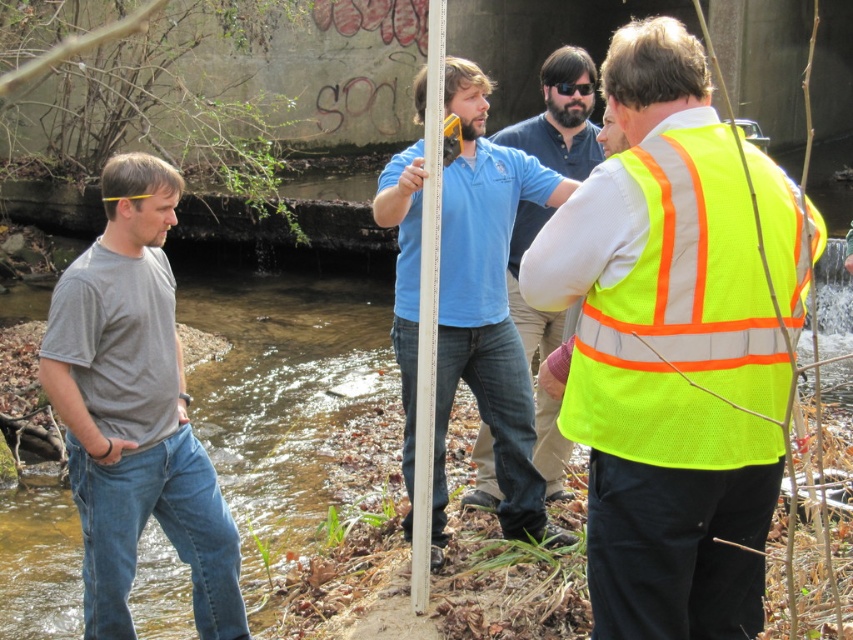
What are the coordinates of the neon yellow safety vest at center?

The neon yellow safety vest at center is located at coordinates point (560, 118).

What is the point at coordinate (682, 321) located on?

The point at coordinate (682, 321) is located on the neon yellow mesh safety vest at right.

Looking at this image, you are standing 2 meters away from the point at coordinates (695, 140). Can you step forward to reach it?

The point at coordinates (695, 140) is 2.53 meters away from you. Since you are only 2 meters away, you can step forward to reach it.